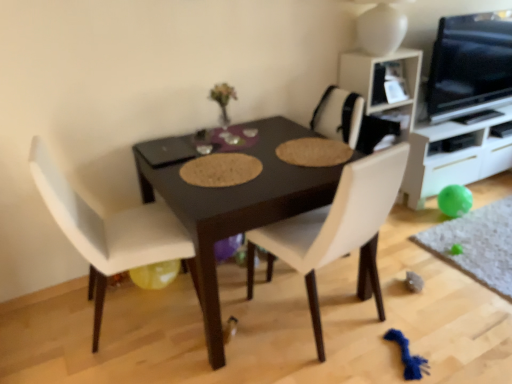
This screenshot has width=512, height=384. Identify the location of vacant region under white leather chair at left, the 1th chair in the left-to-right sequence (from a real-world perspective). (136, 317).